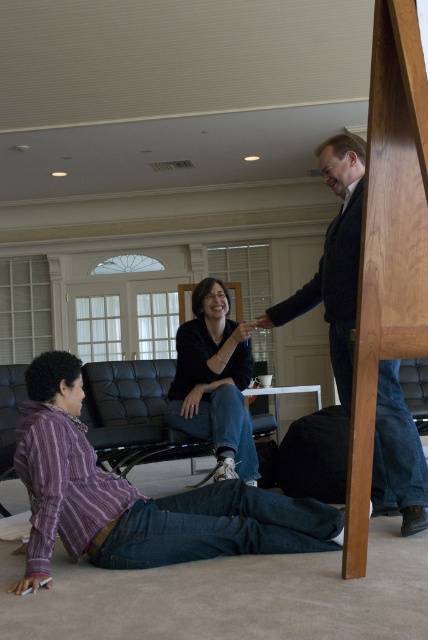
Who is shorter, purple striped shirt at lower left or dark brown wood chair at right?

purple striped shirt at lower left is shorter.

Describe the element at coordinates (137, 497) in the screenshot. I see `purple striped shirt at lower left` at that location.

Locate an element on the screen. This screenshot has height=640, width=428. purple striped shirt at lower left is located at coordinates (137, 497).

Locate an element on the screen. The height and width of the screenshot is (640, 428). dark brown wood chair at right is located at coordinates (333, 260).

Is dark brown wood chair at right bigger than black matte/black jeans at center?

Indeed, dark brown wood chair at right has a larger size compared to black matte/black jeans at center.

Which is behind, point (389, 381) or point (169, 416)?

Positioned behind is point (169, 416).

This screenshot has height=640, width=428. What are the coordinates of `dark brown wood chair at right` in the screenshot? It's located at (333, 260).

Can you confirm if purple striped shirt at lower left is positioned above black matte/black jeans at center?

Actually, purple striped shirt at lower left is below black matte/black jeans at center.

Does purple striped shirt at lower left have a greater width compared to black matte/black jeans at center?

Correct, the width of purple striped shirt at lower left exceeds that of black matte/black jeans at center.

Is point (53, 492) positioned after point (234, 358)?

No.

I want to click on purple striped shirt at lower left, so click(x=137, y=497).